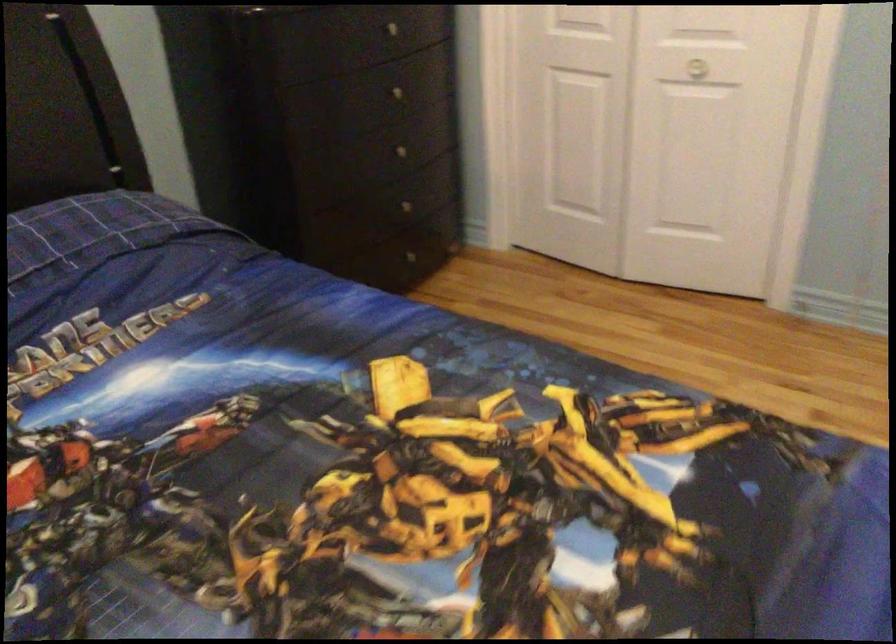
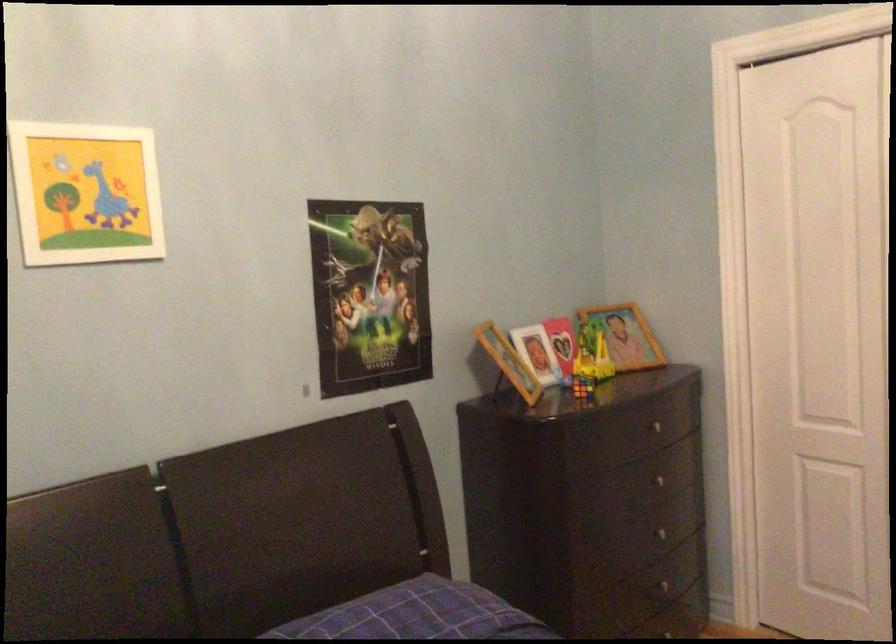
The point at (389, 90) is marked in the first image. Where is the corresponding point in the second image?

(656, 480)